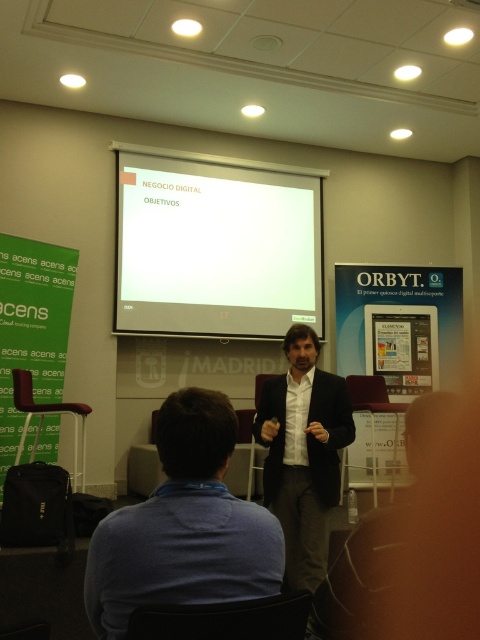
Question: Which point is farther from the camera taking this photo?

Choices:
 (A) (1, 472)
 (B) (245, 317)
 (C) (299, 566)

Answer: (B)

Question: Estimate the real-world distances between objects in this image. Which object is closer to the blue cotton shirt at lower center?

Choices:
 (A) black matte suit at center
 (B) white matte projection screen at center

Answer: (A)

Question: Is white matte projection screen at center below black matte suit at center?

Choices:
 (A) no
 (B) yes

Answer: (A)

Question: Does white matte projection screen at center appear over blue cotton shirt at lower center?

Choices:
 (A) no
 (B) yes

Answer: (B)

Question: Does blue cotton shirt at lower center appear on the left side of green fabric banner at left?

Choices:
 (A) no
 (B) yes

Answer: (A)

Question: Which point appears closest to the camera in this image?

Choices:
 (A) (127, 161)
 (B) (122, 557)

Answer: (B)